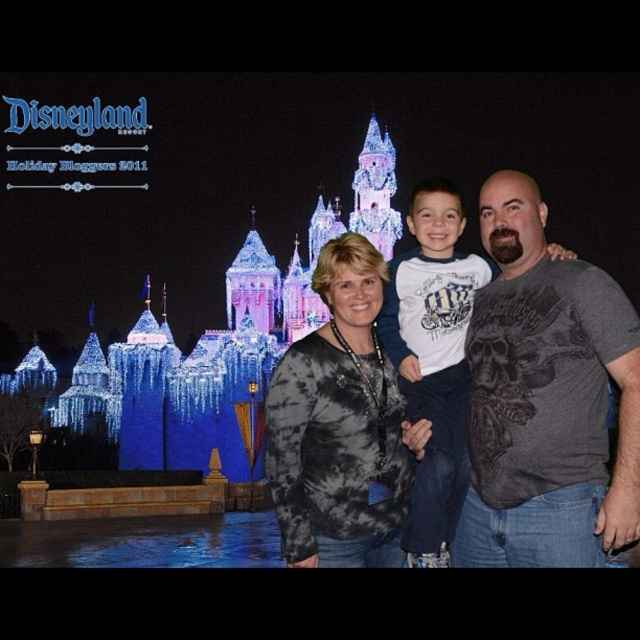
Which of these two, tie-dye long-sleeve shirt at center or white cotton shirt at center, stands taller?

white cotton shirt at center is taller.

Who is positioned more to the left, tie-dye long-sleeve shirt at center or white cotton shirt at center?

Positioned to the left is tie-dye long-sleeve shirt at center.

Who is more forward, (275, 508) or (452, 506)?

Point (452, 506) is more forward.

The height and width of the screenshot is (640, 640). I want to click on tie-dye long-sleeve shirt at center, so click(340, 426).

Is black tie-dye shirt at center above gray printed t-shirt at center?

Incorrect, black tie-dye shirt at center is not positioned above gray printed t-shirt at center.

Can you confirm if black tie-dye shirt at center is positioned to the right of gray printed t-shirt at center?

No, black tie-dye shirt at center is not to the right of gray printed t-shirt at center.

The height and width of the screenshot is (640, 640). I want to click on black tie-dye shirt at center, so click(x=545, y=400).

Between black tie-dye shirt at center and tie-dye long-sleeve shirt at center, which one has less height?

tie-dye long-sleeve shirt at center

Who is taller, black tie-dye shirt at center or tie-dye long-sleeve shirt at center?

Standing taller between the two is black tie-dye shirt at center.

I want to click on black tie-dye shirt at center, so click(545, 400).